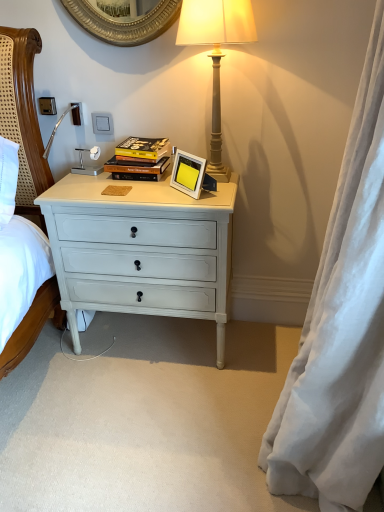
Identify the location of free location to the left of wooden picture frame at center. This screenshot has height=512, width=384. (157, 187).